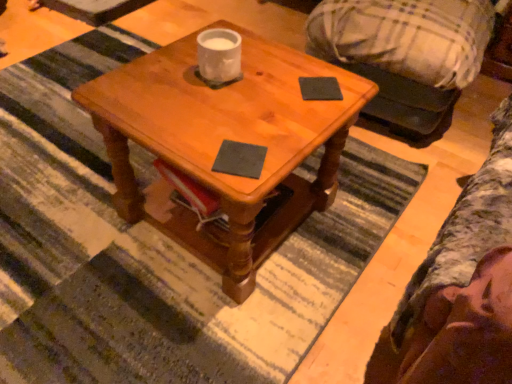
You are a GUI agent. You are given a task and a screenshot of the screen. Output one action in this format:
    pyautogui.click(x=<x>, y=<y>)
    Task: Click on the vacant area that lies between black matte notepad at upper right, the second notepad viewed from the front, and dark gray matte notepad at center, the first notepad positioned from the left
    
    Given the screenshot: What is the action you would take?
    pyautogui.click(x=287, y=121)